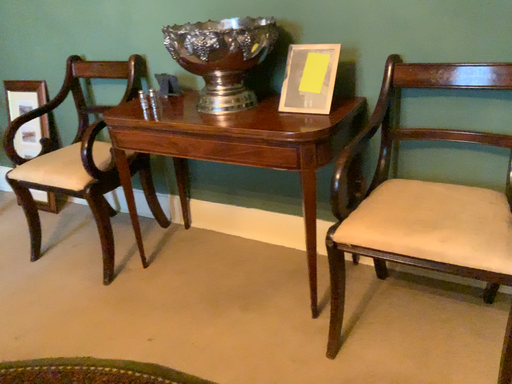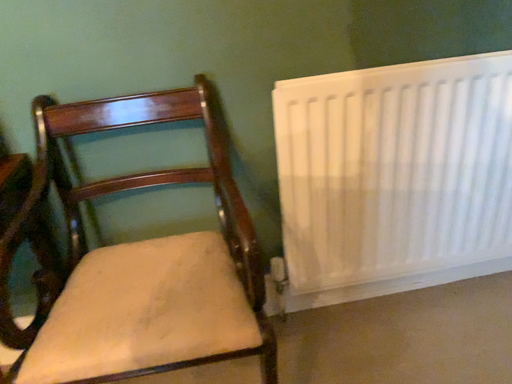
Question: How did the camera likely rotate when shooting the video?

Choices:
 (A) rotated left
 (B) rotated right

Answer: (B)